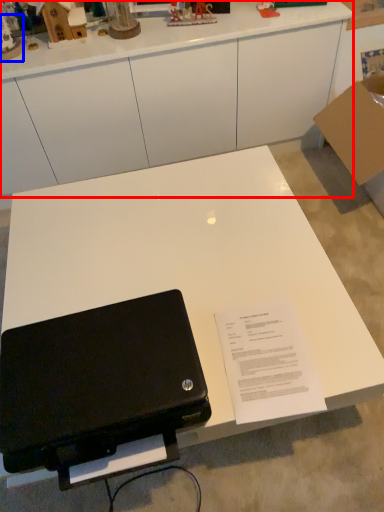
Question: Which point is closer to the camera, desk (highlighted by a red box) or toy (highlighted by a blue box)?

Choices:
 (A) desk
 (B) toy

Answer: (B)